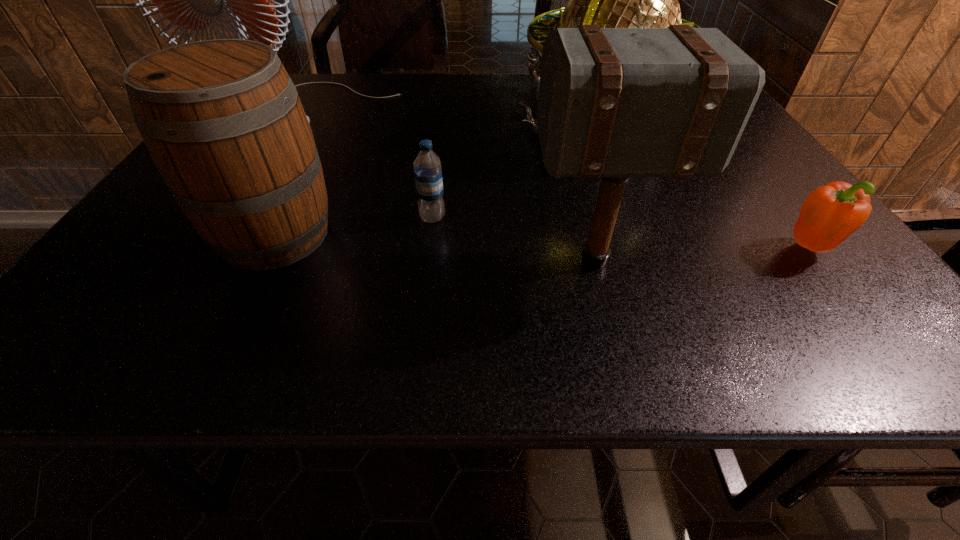
This screenshot has width=960, height=540. Identify the location of free space between the third object from left to right and the pepper. (621, 232).

Locate an element on the screen. The image size is (960, 540). empty location between the mallet and the rightmost object is located at coordinates (703, 254).

This screenshot has width=960, height=540. In order to click on empty space that is in between the water bottle and the third shortest object in this screenshot , I will do `click(353, 226)`.

Where is `vacant area between the rightmost object and the water bottle`? vacant area between the rightmost object and the water bottle is located at coordinates (621, 232).

Select which object is the second closest to the cider. Please provide its 2D coordinates. Your answer should be formatted as a tuple, i.e. [(x, y)], where the tuple contains the x and y coordinates of a point satisfying the conditions above.

[(192, 0)]

You are a GUI agent. You are given a task and a screenshot of the screen. Output one action in this format:
    pyautogui.click(x=<x>, y=<y>)
    Task: Click on the fifth closest object to the tallest object
    The height and width of the screenshot is (540, 960).
    Given the screenshot: What is the action you would take?
    pyautogui.click(x=831, y=213)

Identify the location of vacant position in the image that satisfies the following two spatial constraints: 1. on the back side of the globe; 2. on the right side of the fourth tallest object. (325, 132).

Identify the location of free space that satisfies the following two spatial constraints: 1. on the front-facing side of the pepper; 2. on the right side of the fan. (238, 248).

At what (x,y) coordinates should I click in order to perform the action: click on vacant region that satisfies the following two spatial constraints: 1. on the label of the pepper; 2. on the right side of the fourth object from right to left. Please return your answer as a coordinate pair (x, y). Image resolution: width=960 pixels, height=540 pixels. Looking at the image, I should click on (429, 248).

I want to click on vacant area that satisfies the following two spatial constraints: 1. on the back side of the cider; 2. on the right side of the globe, so click(x=325, y=132).